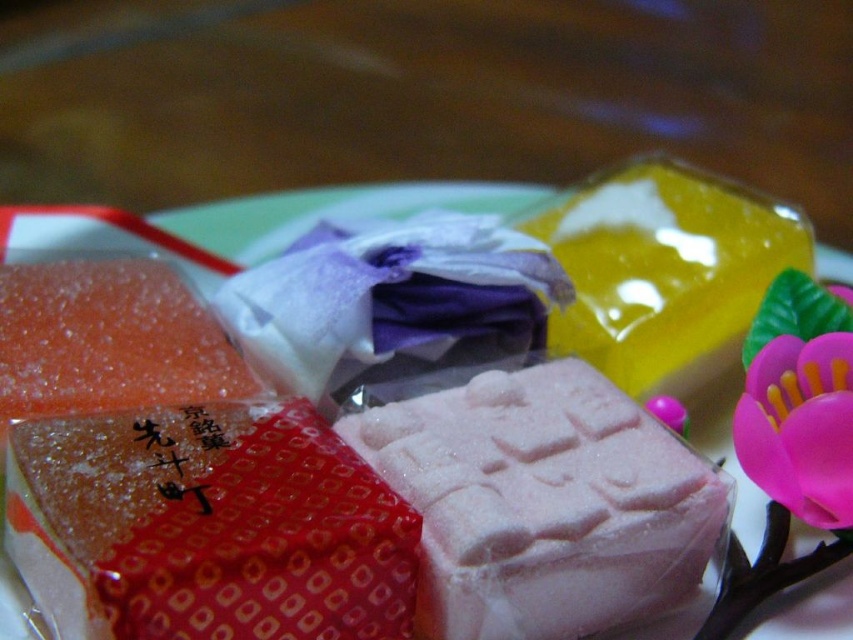
Consider the image. You are a dessert chef trying to place the pink sugary cube at center onto the white paper plate at center. Based on the scene, will the cube fit on the plate?

The pink sugary cube at center is larger in size than the white paper plate at center, so it will not fit on the plate.

You are standing 3 feet away from the plate of colorful cube confections. If you want to reach the point at coordinates point (x=636, y=458) on the plate, will you be able to touch it without moving closer?

The point (x=636, y=458) is 3.59 feet away from the viewer. Since you are standing 3 feet away, you are 0.59 feet closer than the required distance, so you can touch it without moving closer.